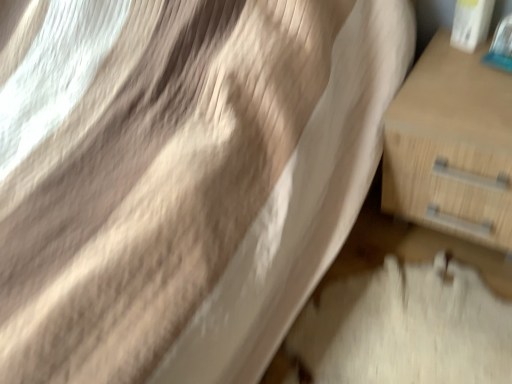
This screenshot has height=384, width=512. Identify the location of empty space that is ontop of light wood drawer at right (from a real-world perspective). (464, 76).